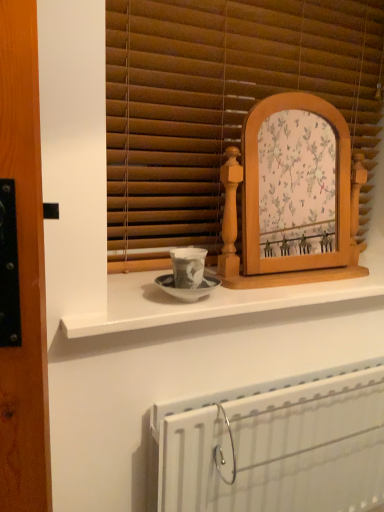
Question: Considering their positions, is wooden picture frame at center located in front of or behind wooden blinds at center?

Choices:
 (A) behind
 (B) front

Answer: (B)

Question: Is wooden picture frame at center inside the boundaries of wooden blinds at center, or outside?

Choices:
 (A) inside
 (B) outside

Answer: (B)

Question: Based on their relative distances, which object is farther from the wooden picture frame at center?

Choices:
 (A) white metallic radiator at lower center
 (B) white glossy counter at center
 (C) wooden blinds at center

Answer: (A)

Question: Which is nearer to the white metallic radiator at lower center?

Choices:
 (A) white glossy counter at center
 (B) wooden picture frame at center
 (C) wooden blinds at center

Answer: (A)